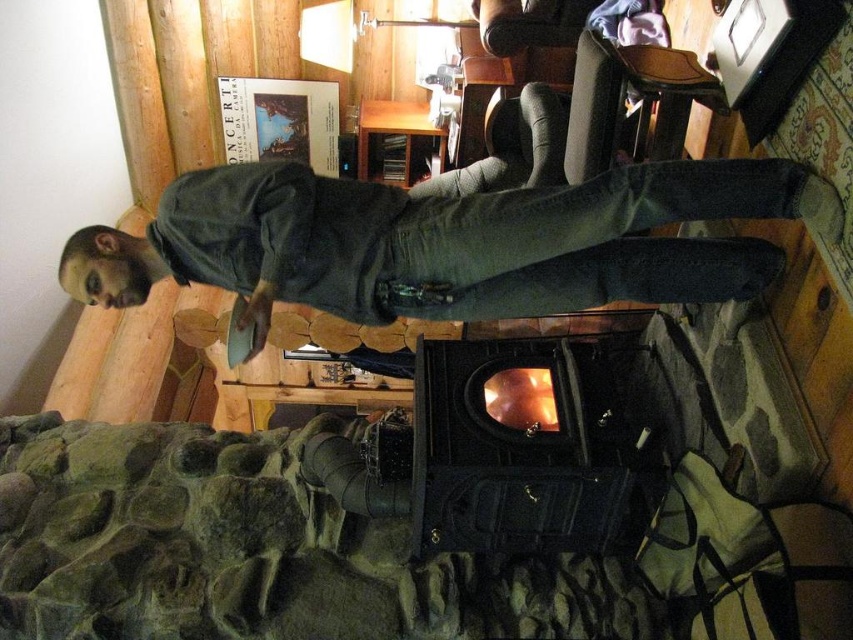
You are standing in the living room and want to grab the dark green shirt at center. Is the black cast iron fireplace at center blocking your path to it?

The dark green shirt at center is closer to the viewer than the black cast iron fireplace at center, so the fireplace is not blocking the path to the shirt.

You are standing in the living room described in the scene. You notice a point marked at coordinates (x=450, y=241). What object is located at that point?

The point at coordinates (x=450, y=241) corresponds to the dark green shirt at center.